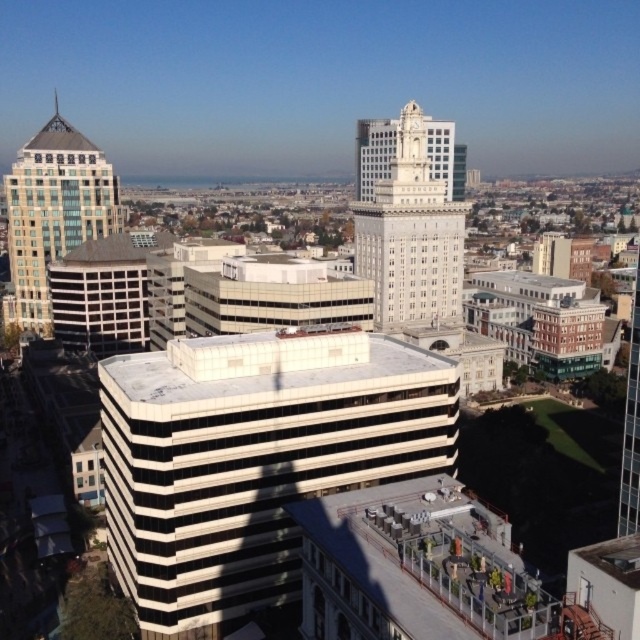
Based on the cityscape scene, which object has a smaller width between the white marble clock tower at center and the matte glass building at upper left?

The white marble clock tower at center has a smaller width than the matte glass building at upper left.

You are a drone operator planning to fly a drone from the white striped building at center to the matte glass building at upper left. The drone has a maximum flight range of 140 meters. Based on the cityscape shown, will the drone be able to reach its destination without needing to recharge?

The white striped building at center is 141.80 meters from the matte glass building at upper left. Since the drone has a maximum flight range of 140 meters, it will not be able to reach the matte glass building at upper left without recharging.

You are standing in the city square and want to take a photo of both the white marble clock tower at center and the matte glass building at upper left. Which one should you focus on first to ensure both are in sharp focus?

You should focus on the white marble clock tower at center first because it is closer to you than the matte glass building at upper left, so adjusting focus from near to far will help both be in sharp focus.